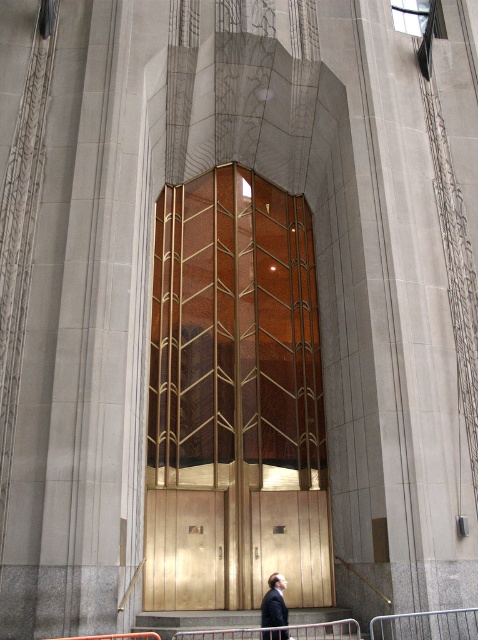
Between point (228, 548) and point (151, 616), which one is positioned in front?

Point (151, 616) is in front.

Is gold textured elevator at center further to the viewer compared to gold metallic stair at center?

Yes, it is behind gold metallic stair at center.

Is point (229, 346) farther from viewer compared to point (161, 621)?

Yes.

Locate an element on the screen. The width and height of the screenshot is (478, 640). gold textured elevator at center is located at coordinates (235, 400).

From the picture: Does gold metallic stair at center have a larger size compared to dark suit at center?

Actually, gold metallic stair at center might be smaller than dark suit at center.

Is gold metallic stair at center positioned before dark suit at center?

No, gold metallic stair at center is further to the viewer.

Does point (227, 612) come farther from viewer compared to point (274, 596)?

Yes, it is behind point (274, 596).

You are a GUI agent. You are given a task and a screenshot of the screen. Output one action in this format:
    pyautogui.click(x=<x>, y=<y>)
    Task: Click on the gold metallic stair at center
    This screenshot has width=478, height=640.
    Given the screenshot: What is the action you would take?
    pyautogui.click(x=201, y=624)

Which is below, gold textured elevator at center or dark suit at center?

dark suit at center is lower down.

How much distance is there between gold textured elevator at center and dark suit at center?

They are 32.10 feet apart.

Between point (330, 600) and point (264, 600), which one is positioned in front?

Point (264, 600)

Locate an element on the screen. The image size is (478, 640). gold textured elevator at center is located at coordinates (235, 400).